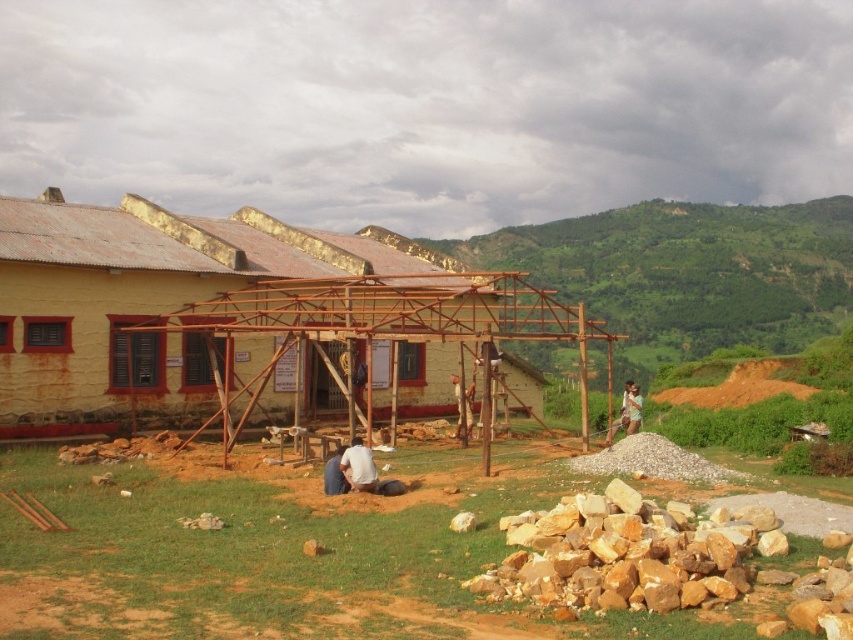
Question: Is yellow painted wood at center thinner than green fabric shirt at center?

Choices:
 (A) no
 (B) yes

Answer: (A)

Question: Is yellow painted wood at center below green fabric shirt at center?

Choices:
 (A) yes
 (B) no

Answer: (B)

Question: Which point is closer to the camera?

Choices:
 (A) green fabric shirt at center
 (B) yellow painted wood at center

Answer: (B)

Question: Which point appears closest to the camera in this image?

Choices:
 (A) (119, 369)
 (B) (622, 416)

Answer: (A)

Question: Does yellow painted wood at center have a smaller size compared to green fabric shirt at center?

Choices:
 (A) yes
 (B) no

Answer: (B)